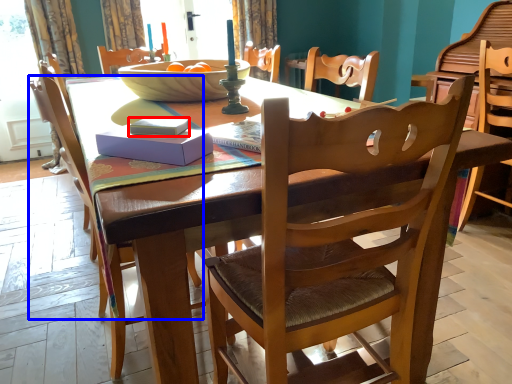
Question: Which object appears farthest to the camera in this image, book (highlighted by a red box) or chair (highlighted by a blue box)?

Choices:
 (A) book
 (B) chair

Answer: (B)